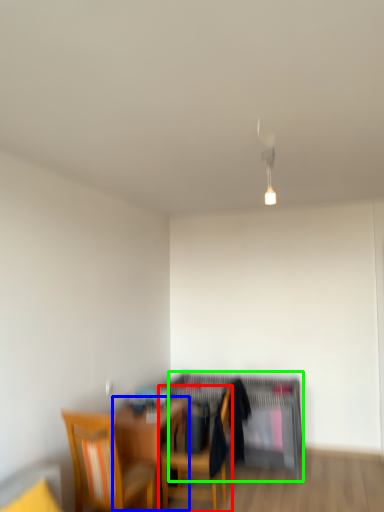
Question: Which object is positioned farthest from chair (highlighted by a red box)? Select from table (highlighted by a blue box) and computer desk (highlighted by a green box).

Choices:
 (A) table
 (B) computer desk

Answer: (B)